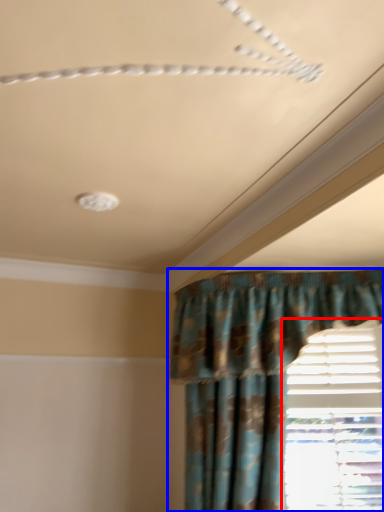
Question: Which object appears closest to the camera in this image, window (highlighted by a red box) or curtain (highlighted by a blue box)?

Choices:
 (A) window
 (B) curtain

Answer: (B)